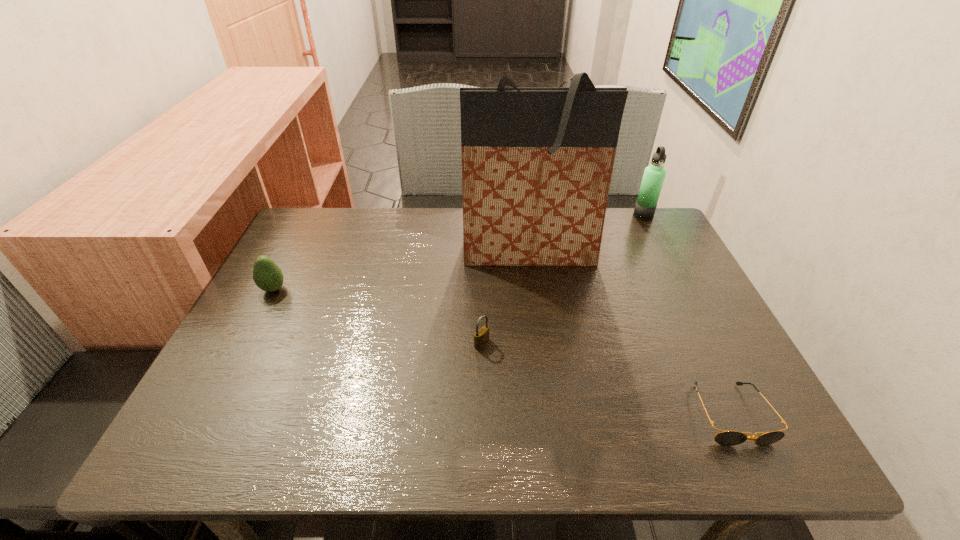
Locate an element on the screen. This screenshot has width=960, height=540. object that is at the far right corner is located at coordinates (654, 175).

Locate an element on the screen. The width and height of the screenshot is (960, 540). object situated at the near right corner is located at coordinates (728, 438).

Where is `free space at the far edge of the desktop`? free space at the far edge of the desktop is located at coordinates (443, 253).

Locate an element on the screen. The height and width of the screenshot is (540, 960). free spot at the near edge of the desktop is located at coordinates (680, 449).

In the image, there is a desktop. Where is `vacant space at the left edge`? This screenshot has height=540, width=960. vacant space at the left edge is located at coordinates (318, 263).

In the image, there is a desktop. Where is `vacant space at the right edge`? This screenshot has width=960, height=540. vacant space at the right edge is located at coordinates (666, 336).

In order to click on free point at the far left corner in this screenshot , I will do `click(340, 245)`.

Image resolution: width=960 pixels, height=540 pixels. Identify the location of free spot at the near left corner of the desktop. (187, 446).

Image resolution: width=960 pixels, height=540 pixels. Find the location of `free region at the far right corner of the desktop`. free region at the far right corner of the desktop is located at coordinates (658, 222).

The height and width of the screenshot is (540, 960). What are the coordinates of `free spot between the fourth tallest object and the leftmost object` in the screenshot? It's located at (377, 316).